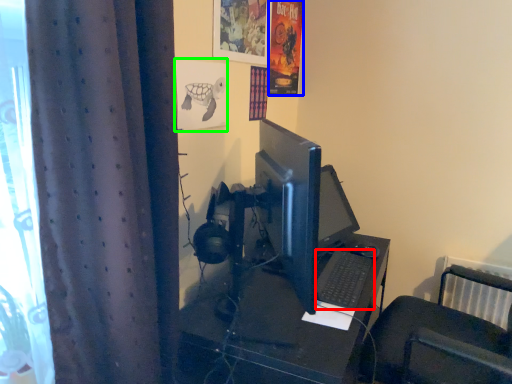
Question: Which is nearer to the computer keyboard (highlighted by a red box)? poster page (highlighted by a blue box) or poster page (highlighted by a green box).

Choices:
 (A) poster page
 (B) poster page

Answer: (B)